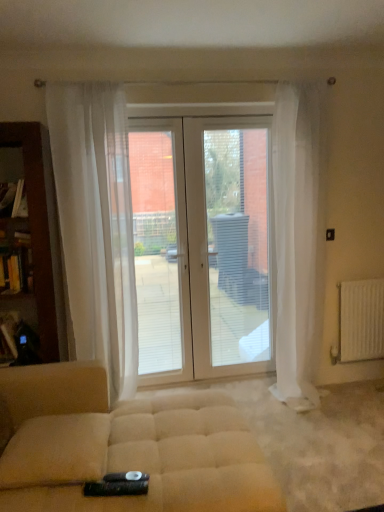
How much space does white sheer curtain at right, which ranks as the 1th curtain in right-to-left order, occupy vertically?

It is 7.21 feet.

What is the approximate width of white sheer curtain at right, which ranks as the 1th curtain in right-to-left order?

The width of white sheer curtain at right, which ranks as the 1th curtain in right-to-left order, is 14.48 inches.

This screenshot has width=384, height=512. Describe the element at coordinates (229, 248) in the screenshot. I see `white plastic screen door at center` at that location.

The width and height of the screenshot is (384, 512). Describe the element at coordinates (37, 227) in the screenshot. I see `brown wood bookshelf at left` at that location.

At what (x,y) coordinates should I click in order to perform the action: click on sheer white curtain at center, which ranks as the first curtain in left-to-right order. Please return your answer as a coordinate pair (x, y). The width and height of the screenshot is (384, 512). Looking at the image, I should click on (96, 225).

Between white plastic screen door at center and white glossy door at center, which one has smaller size?

With smaller size is white glossy door at center.

From a real-world perspective, is white plastic screen door at center beneath white glossy door at center?

Actually, white plastic screen door at center is physically above white glossy door at center in the real world.

In terms of height, does white plastic screen door at center look taller or shorter compared to white glossy door at center?

In the image, white plastic screen door at center appears to be shorter than white glossy door at center.

Does white plastic screen door at center touch white glossy door at center?

Absolutely, white plastic screen door at center is next to and touching white glossy door at center.

From a real-world perspective, between sheer white curtain at center, which ranks as the first curtain in left-to-right order, and beige fabric ottoman at center, who is vertically lower?

In real-world perspective, beige fabric ottoman at center is lower.

Could you tell me if sheer white curtain at center, which ranks as the first curtain in left-to-right order, is facing beige fabric ottoman at center?

Yes.

Looking at this image, which of these two, sheer white curtain at center, placed as the second curtain when sorted from right to left, or beige fabric ottoman at center, is thinner?

Thinner between the two is sheer white curtain at center, placed as the second curtain when sorted from right to left.

From the image's perspective, between white metallic radiator at right and sheer white curtain at center, which ranks as the first curtain in left-to-right order, who is located below?

white metallic radiator at right, from the image's perspective.

Considering the sizes of white metallic radiator at right and sheer white curtain at center, placed as the second curtain when sorted from right to left, in the image, is white metallic radiator at right wider or thinner than sheer white curtain at center, placed as the second curtain when sorted from right to left,?

white metallic radiator at right is thinner than sheer white curtain at center, placed as the second curtain when sorted from right to left.

Can you confirm if white metallic radiator at right is taller than sheer white curtain at center, which ranks as the first curtain in left-to-right order?

In fact, white metallic radiator at right may be shorter than sheer white curtain at center, which ranks as the first curtain in left-to-right order.

From a real-world perspective, is white metallic radiator at right positioned over sheer white curtain at center, placed as the second curtain when sorted from right to left, based on gravity?

No, from a real-world perspective, white metallic radiator at right is not above sheer white curtain at center, placed as the second curtain when sorted from right to left.

Considering the sizes of objects beige fabric ottoman at center and sheer white curtain at center, placed as the second curtain when sorted from right to left, in the image provided, who is shorter, beige fabric ottoman at center or sheer white curtain at center, placed as the second curtain when sorted from right to left,?

beige fabric ottoman at center is shorter.

From the image's perspective, is beige fabric ottoman at center over sheer white curtain at center, placed as the second curtain when sorted from right to left?

No, from the image's perspective, beige fabric ottoman at center is not above sheer white curtain at center, placed as the second curtain when sorted from right to left.

Is point (221, 410) behind point (111, 201)?

No, it is not.

Can you confirm if beige fabric ottoman at center is positioned to the right of sheer white curtain at center, placed as the second curtain when sorted from right to left?

Indeed, beige fabric ottoman at center is positioned on the right side of sheer white curtain at center, placed as the second curtain when sorted from right to left.

Considering the positions of objects white metallic radiator at right and white sheer curtain at right, which ranks as the 1th curtain in right-to-left order, in the image provided, who is more to the left, white metallic radiator at right or white sheer curtain at right, which ranks as the 1th curtain in right-to-left order,?

white sheer curtain at right, which ranks as the 1th curtain in right-to-left order, is more to the left.

How many degrees apart are the facing directions of white metallic radiator at right and white sheer curtain at right, the second curtain viewed from the left?

4.34 degrees separate the facing orientations of white metallic radiator at right and white sheer curtain at right, the second curtain viewed from the left.

Would you say white metallic radiator at right is a long distance from white sheer curtain at right, which ranks as the 1th curtain in right-to-left order?

No, white metallic radiator at right is in close proximity to white sheer curtain at right, which ranks as the 1th curtain in right-to-left order.

From their relative heights in the image, would you say white metallic radiator at right is taller or shorter than white sheer curtain at right, which ranks as the 1th curtain in right-to-left order?

white metallic radiator at right is shorter than white sheer curtain at right, which ranks as the 1th curtain in right-to-left order.

Is white plastic screen door at center aimed at sheer white curtain at center, which ranks as the first curtain in left-to-right order?

No, white plastic screen door at center does not turn towards sheer white curtain at center, which ranks as the first curtain in left-to-right order.

Is sheer white curtain at center, placed as the second curtain when sorted from right to left, inside white plastic screen door at center?

No.

Consider the image. Can you confirm if white plastic screen door at center is smaller than sheer white curtain at center, which ranks as the first curtain in left-to-right order?

Yes, white plastic screen door at center is smaller than sheer white curtain at center, which ranks as the first curtain in left-to-right order.

How much distance is there between white plastic screen door at center and sheer white curtain at center, placed as the second curtain when sorted from right to left?

white plastic screen door at center is 77.41 centimeters away from sheer white curtain at center, placed as the second curtain when sorted from right to left.

Is white plastic screen door at center shorter than brown wood bookshelf at left?

No, white plastic screen door at center is not shorter than brown wood bookshelf at left.

Which object is positioned more to the left, white plastic screen door at center or brown wood bookshelf at left?

brown wood bookshelf at left is more to the left.

Looking at this image, is white plastic screen door at center located outside brown wood bookshelf at left?

Yes, white plastic screen door at center is not within brown wood bookshelf at left.

Locate an element on the screen. screen door positioned vertically above the white glossy door at center (from a real-world perspective) is located at coordinates (229, 248).

Locate an element on the screen. The width and height of the screenshot is (384, 512). studio couch below the sheer white curtain at center, which ranks as the first curtain in left-to-right order (from a real-world perspective) is located at coordinates (124, 446).

In the scene shown: From the image, which object appears to be farther from beige fabric ottoman at center, white metallic radiator at right or sheer white curtain at center, which ranks as the first curtain in left-to-right order?

white metallic radiator at right is further to beige fabric ottoman at center.

Based on the photo, looking at the image, which one is located further to white plastic screen door at center, beige fabric ottoman at center or white glossy door at center?

beige fabric ottoman at center is further to white plastic screen door at center.

Based on their spatial positions, is white metallic radiator at right or brown wood bookshelf at left further from white sheer curtain at right, the second curtain viewed from the left?

brown wood bookshelf at left is further to white sheer curtain at right, the second curtain viewed from the left.

Based on their spatial positions, is white plastic screen door at center or white metallic radiator at right closer to sheer white curtain at center, placed as the second curtain when sorted from right to left?

white plastic screen door at center.

Looking at the image, which one is located closer to sheer white curtain at center, placed as the second curtain when sorted from right to left, white plastic screen door at center or white glossy door at center?

Based on the image, white glossy door at center appears to be nearer to sheer white curtain at center, placed as the second curtain when sorted from right to left.

Estimate the real-world distances between objects in this image. Which object is further from beige fabric ottoman at center, white plastic screen door at center or brown wood bookshelf at left?

white plastic screen door at center lies further to beige fabric ottoman at center than the other object.

Considering their positions, is white sheer curtain at right, which ranks as the 1th curtain in right-to-left order, positioned closer to white metallic radiator at right than white plastic screen door at center?

white sheer curtain at right, which ranks as the 1th curtain in right-to-left order, is closer to white metallic radiator at right.

When comparing their distances from sheer white curtain at center, placed as the second curtain when sorted from right to left, does brown wood bookshelf at left or white metallic radiator at right seem further?

Among the two, white metallic radiator at right is located further to sheer white curtain at center, placed as the second curtain when sorted from right to left.

At what (x,y) coordinates should I click in order to perform the action: click on screen door situated between brown wood bookshelf at left and white metallic radiator at right from left to right. Please return your answer as a coordinate pair (x, y). Looking at the image, I should click on (229, 248).

Where is `screen door between brown wood bookshelf at left and white sheer curtain at right, the second curtain viewed from the left, in the horizontal direction`? This screenshot has height=512, width=384. screen door between brown wood bookshelf at left and white sheer curtain at right, the second curtain viewed from the left, in the horizontal direction is located at coordinates (229, 248).

The image size is (384, 512). I want to click on screen door located between white glossy door at center and white sheer curtain at right, which ranks as the 1th curtain in right-to-left order, in the left-right direction, so click(x=229, y=248).

The height and width of the screenshot is (512, 384). In order to click on studio couch between sheer white curtain at center, placed as the second curtain when sorted from right to left, and white sheer curtain at right, the second curtain viewed from the left, from left to right in this screenshot , I will do `click(124, 446)`.